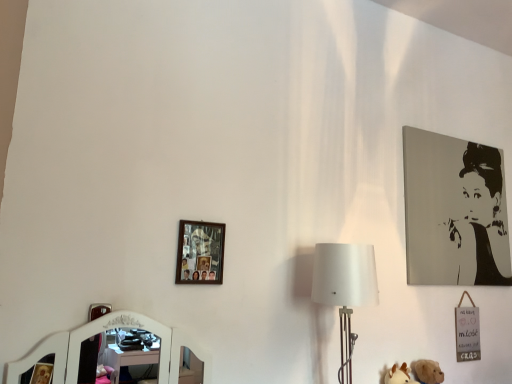
Question: Can you confirm if wooden photo frame at upper left, which is the second picture frame in back-to-front order, is smaller than white fabric lampshade at center-right?

Choices:
 (A) yes
 (B) no

Answer: (A)

Question: Considering the relative sizes of wooden photo frame at upper left, the 1th picture frame in the front-to-back sequence, and white fabric lampshade at center-right in the image provided, is wooden photo frame at upper left, the 1th picture frame in the front-to-back sequence, thinner than white fabric lampshade at center-right?

Choices:
 (A) yes
 (B) no

Answer: (A)

Question: Is wooden photo frame at upper left, the 1th picture frame in the front-to-back sequence, closer to the viewer compared to white fabric lampshade at center-right?

Choices:
 (A) no
 (B) yes

Answer: (A)

Question: Is wooden photo frame at upper left, the 1th picture frame in the front-to-back sequence, wider than white fabric lampshade at center-right?

Choices:
 (A) yes
 (B) no

Answer: (B)

Question: From the image's perspective, is wooden photo frame at upper left, the 1th picture frame in the front-to-back sequence, beneath white fabric lampshade at center-right?

Choices:
 (A) no
 (B) yes

Answer: (A)

Question: Considering the relative sizes of wooden photo frame at upper left, which is the second picture frame in back-to-front order, and white fabric lampshade at center-right in the image provided, is wooden photo frame at upper left, which is the second picture frame in back-to-front order, shorter than white fabric lampshade at center-right?

Choices:
 (A) no
 (B) yes

Answer: (B)

Question: Is wooden photo frame at upper left, the 1th picture frame in the front-to-back sequence, wider than black and white portrait at upper right, which is the 2th picture frame in front-to-back order?

Choices:
 (A) yes
 (B) no

Answer: (B)

Question: From a real-world perspective, is wooden photo frame at upper left, the 2th picture frame in the right-to-left sequence, located higher than black and white portrait at upper right, the second picture frame in the left-to-right sequence?

Choices:
 (A) yes
 (B) no

Answer: (B)

Question: Can you confirm if wooden photo frame at upper left, the 2th picture frame in the right-to-left sequence, is thinner than black and white portrait at upper right, the 1th picture frame from the right?

Choices:
 (A) yes
 (B) no

Answer: (A)

Question: Is black and white portrait at upper right, the 1th picture frame from the right, at the back of wooden photo frame at upper left, the 2th picture frame in the right-to-left sequence?

Choices:
 (A) yes
 (B) no

Answer: (B)

Question: Considering the relative sizes of wooden photo frame at upper left, the 1th picture frame in the front-to-back sequence, and black and white portrait at upper right, which is the 2th picture frame in front-to-back order, in the image provided, is wooden photo frame at upper left, the 1th picture frame in the front-to-back sequence, shorter than black and white portrait at upper right, which is the 2th picture frame in front-to-back order,?

Choices:
 (A) yes
 (B) no

Answer: (A)

Question: Can we say wooden photo frame at upper left, arranged as the first picture frame when viewed from the left, lies outside black and white portrait at upper right, the second picture frame in the left-to-right sequence?

Choices:
 (A) yes
 (B) no

Answer: (A)

Question: Considering the relative sizes of white fabric lampshade at center-right and black and white portrait at upper right, which is the 2th picture frame in front-to-back order, in the image provided, is white fabric lampshade at center-right bigger than black and white portrait at upper right, which is the 2th picture frame in front-to-back order,?

Choices:
 (A) yes
 (B) no

Answer: (A)